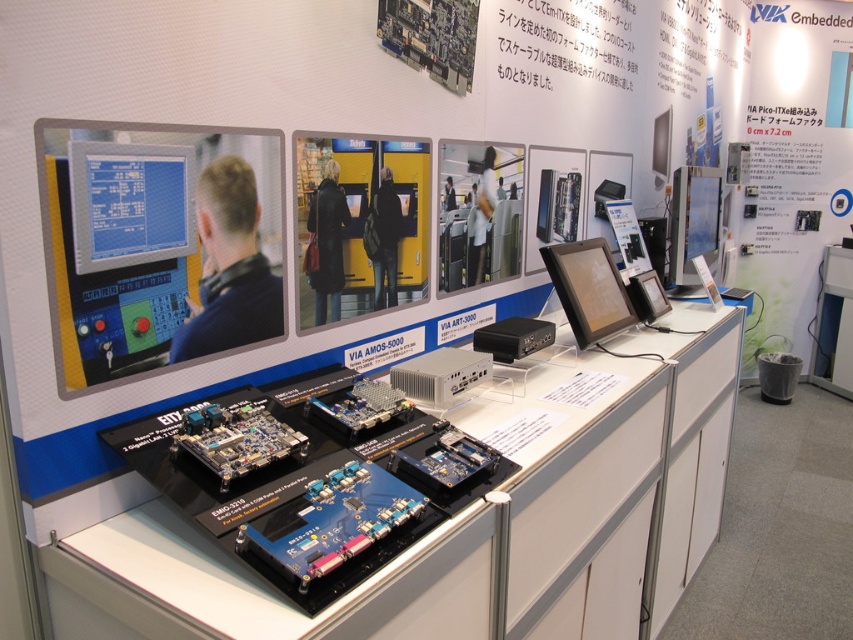
You are an attendee at the trade show and want to see both the matte black monitor at center and the white matte jacket at center. Which object should you stand closer to in order to get a better view?

Since the matte black monitor at center is larger than the white matte jacket at center, you should stand closer to the white matte jacket at center to see both objects clearly.

You are a trade show attendee and you see the white paper at upper right and the white matte jacket at center. Which one is larger in size?

The white paper at upper right is bigger than the white matte jacket at center.

You are an engineer attending the exhibition and need to place both the blue circuit board at center and the matte black monitor at upper right onto a transport cart. The cart has a shelf width of 40 cm. Given their sizes, can both items fit side by side on the shelf without overlapping?

The blue circuit board at center has a lesser width compared to matte black monitor at upper right. However, since the total combined width of both items is not provided, it is impossible to determine if they can fit side by side on the 40 cm shelf without overlapping.